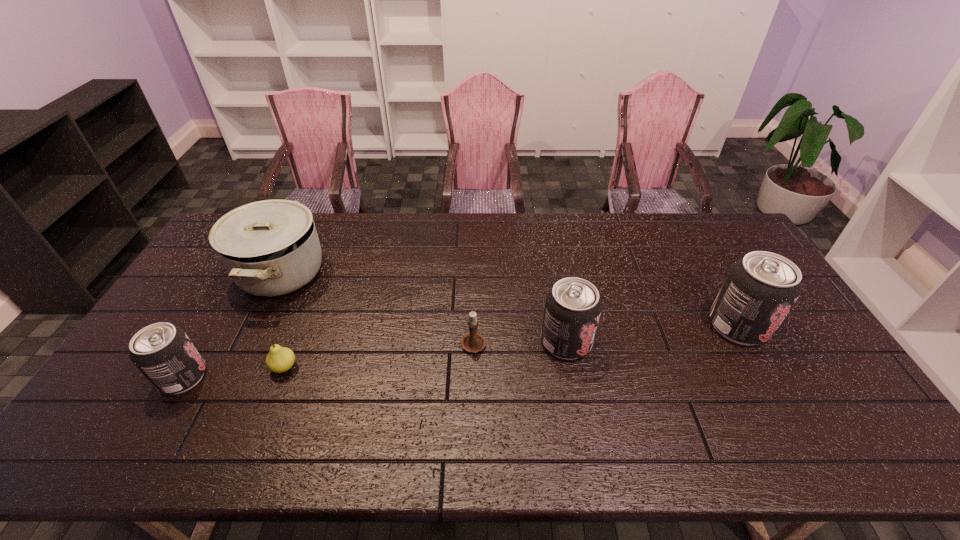
Identify the location of vacant area between the leftmost soda can and the second shortest object. (328, 360).

Where is `free space between the rightmost object and the pear`? The image size is (960, 540). free space between the rightmost object and the pear is located at coordinates (512, 347).

Identify the location of free point between the third shortest object and the saucepan. This screenshot has height=540, width=960. (231, 325).

This screenshot has width=960, height=540. In order to click on free area in between the fourth object from left to right and the rightmost soda can in this screenshot , I will do `click(606, 334)`.

Locate an element on the screen. The height and width of the screenshot is (540, 960). vacant space in between the shortest object and the rightmost object is located at coordinates (512, 347).

Find the location of `free space between the fifth tallest object and the shortest object`. free space between the fifth tallest object and the shortest object is located at coordinates (379, 355).

Locate an element on the screen. The width and height of the screenshot is (960, 540). free space between the fifth object from left to right and the rightmost soda can is located at coordinates (652, 334).

Identify the location of free space between the saucepan and the pear. 282,320.

Identify the location of vacant space in between the rightmost soda can and the shortest soda can. (x=461, y=352).

Find the location of a particular element. object that can be found as the third closest to the second object from right to left is located at coordinates (280, 359).